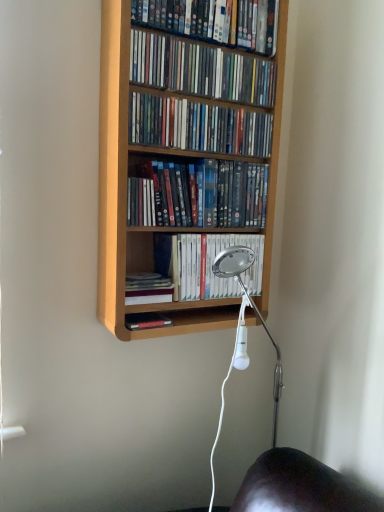
Question: Should I look upward or downward to see light wood bookcase at center?

Choices:
 (A) up
 (B) down

Answer: (A)

Question: Considering the relative positions of white glossy book at center, the 5th book in the top-to-bottom sequence, and matte plastic dvds at upper center, which ranks as the third book in top-to-bottom order, in the image provided, is white glossy book at center, the 5th book in the top-to-bottom sequence, to the left of matte plastic dvds at upper center, which ranks as the third book in top-to-bottom order, from the viewer's perspective?

Choices:
 (A) no
 (B) yes

Answer: (A)

Question: Is white glossy book at center, acting as the second book starting from the bottom, further to the viewer compared to matte plastic dvds at upper center, which appears as the fourth book when ordered from the bottom?

Choices:
 (A) no
 (B) yes

Answer: (B)

Question: Does white glossy book at center, the 5th book in the top-to-bottom sequence, have a lesser height compared to matte plastic dvds at upper center, which appears as the fourth book when ordered from the bottom?

Choices:
 (A) yes
 (B) no

Answer: (B)

Question: Is matte plastic dvds at upper center, which appears as the fourth book when ordered from the bottom, at the back of white glossy book at center, the 5th book in the top-to-bottom sequence?

Choices:
 (A) no
 (B) yes

Answer: (A)

Question: Is white glossy book at center, acting as the second book starting from the bottom, aimed at matte plastic dvds at upper center, which appears as the fourth book when ordered from the bottom?

Choices:
 (A) no
 (B) yes

Answer: (A)

Question: Does white glossy book at center, acting as the second book starting from the bottom, have a greater width compared to matte plastic dvds at upper center, which appears as the fourth book when ordered from the bottom?

Choices:
 (A) yes
 (B) no

Answer: (B)

Question: Would you consider matte plastic dvds at center, positioned as the 4th book in top-to-bottom order, to be distant from matte plastic dvds at upper center, the first book positioned from the top?

Choices:
 (A) yes
 (B) no

Answer: (B)

Question: Can you confirm if matte plastic dvds at center, the 3th book from the bottom, is positioned to the left of matte plastic dvds at upper center, the sixth book positioned from the bottom?

Choices:
 (A) no
 (B) yes

Answer: (B)

Question: From the image's perspective, is matte plastic dvds at center, positioned as the 4th book in top-to-bottom order, located beneath matte plastic dvds at upper center, the sixth book positioned from the bottom?

Choices:
 (A) no
 (B) yes

Answer: (B)

Question: Would you say matte plastic dvds at upper center, the sixth book positioned from the bottom, is part of matte plastic dvds at center, positioned as the 4th book in top-to-bottom order,'s contents?

Choices:
 (A) yes
 (B) no

Answer: (B)

Question: Does matte plastic dvds at center, the 3th book from the bottom, have a lesser width compared to matte plastic dvds at upper center, the first book positioned from the top?

Choices:
 (A) no
 (B) yes

Answer: (B)

Question: Does matte plastic dvds at center, positioned as the 4th book in top-to-bottom order, turn towards matte plastic dvds at upper center, the first book positioned from the top?

Choices:
 (A) no
 (B) yes

Answer: (A)

Question: Is matte plastic dvds at upper center, which ranks as the third book in top-to-bottom order, positioned with its back to light wood bookcase at center?

Choices:
 (A) yes
 (B) no

Answer: (A)